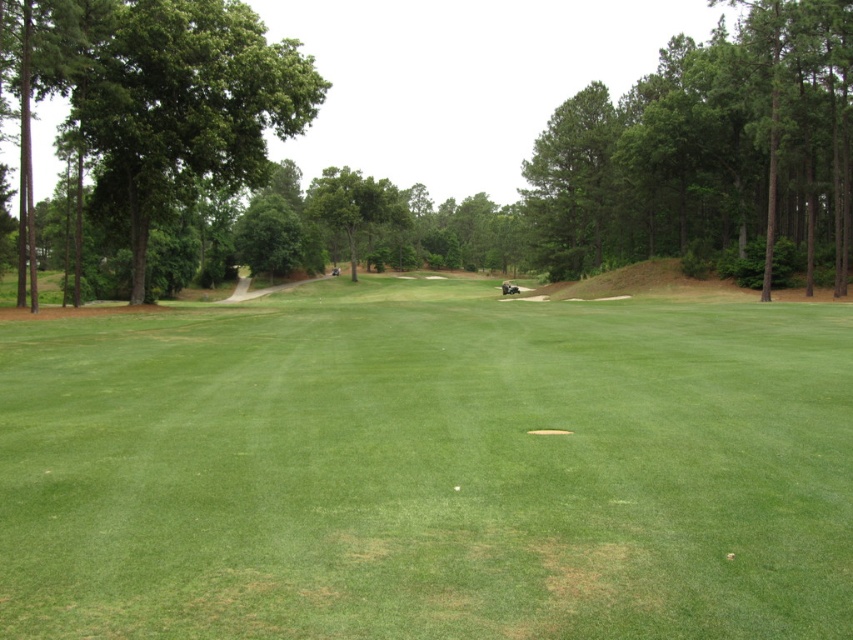
You are a golfer standing between the green leafy tree at right and the green leafy tree at left. You want to hit a golf ball to a hole that is 150 feet away from you. Can you safely hit the ball between these two trees without hitting either of them?

The distance between the green leafy tree at right and the green leafy tree at left is 136.95 feet. Since the hole is 150 feet away from you, which is farther than the gap between the trees, you can safely hit the ball between them without hitting either tree.

You are standing at the center of the golf course and see two points marked on the ground. The first point is at coordinate point (146,344) and the second is at point (848,22). Which point is closer to your current position?

Point (146,344) is closer to the camera than point (848,22), so the first point is closer to your current position.

You are a golfer standing on the green grassy field at center and want to walk towards the green leafy tree at center. In which direction should you walk?

The green grassy field at center is positioned on the right side of the green leafy tree at center, so to walk towards the tree, you should walk to the left.